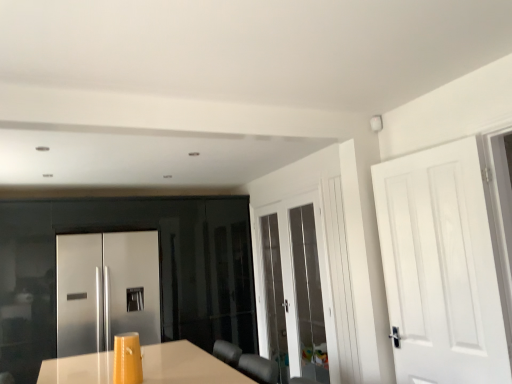
You are a GUI agent. You are given a task and a screenshot of the screen. Output one action in this format:
    pyautogui.click(x=<x>, y=<y>)
    Task: Click on the white matte door at right, arranged as the 3th door when viewed from the left
    
    Given the screenshot: What is the action you would take?
    pyautogui.click(x=442, y=266)

Locate an element on the screen. white glossy door at center, the second door from the front is located at coordinates (293, 288).

Is satin stainless steel refrigerator at center, placed as the first door when sorted from back to front, inside or outside of white matte door at right, which is the third door from back to front?

satin stainless steel refrigerator at center, placed as the first door when sorted from back to front, is not inside white matte door at right, which is the third door from back to front, it's outside.

Is satin stainless steel refrigerator at center, which is the third door in front-to-back order, bigger than white matte door at right, acting as the 1th door starting from the front?

Yes, satin stainless steel refrigerator at center, which is the third door in front-to-back order, is bigger than white matte door at right, acting as the 1th door starting from the front.

Based on the photo, which object is further away from the camera, satin stainless steel refrigerator at center, which ranks as the 1th door in left-to-right order, or white matte door at right, which is the third door from back to front?

satin stainless steel refrigerator at center, which ranks as the 1th door in left-to-right order.

From the image's perspective, which one is positioned lower, satin stainless steel refrigerator at center, marked as the 3th door in a right-to-left arrangement, or white matte door at right, arranged as the 3th door when viewed from the left?

satin stainless steel refrigerator at center, marked as the 3th door in a right-to-left arrangement, is shown below in the image.

Does white glossy door at center, the second door from the front, have a larger size compared to white matte door at right, acting as the 1th door starting from the front?

Yes.

From the image's perspective, is white glossy door at center, the second door from the front, positioned above or below white matte door at right, arranged as the 3th door when viewed from the left?

Based on their image positions, white glossy door at center, the second door from the front, is located beneath white matte door at right, arranged as the 3th door when viewed from the left.

Is white glossy door at center, the second door from the front, looking in the opposite direction of white matte door at right, which is counted as the first door, starting from the right?

No, white glossy door at center, the second door from the front,'s orientation is not away from white matte door at right, which is counted as the first door, starting from the right.

Identify the location of the 1st door below when counting from the white matte door at right, which is the third door from back to front (from the image's perspective). (293, 288).

Which object is positioned more to the right, white glossy door at center, which is counted as the second door, starting from the back, or satin stainless steel refrigerator at center, which is the third door in front-to-back order?

From the viewer's perspective, white glossy door at center, which is counted as the second door, starting from the back, appears more on the right side.

From the image's perspective, between white glossy door at center, the second door from the front, and satin stainless steel refrigerator at center, placed as the first door when sorted from back to front, which one is located above?

white glossy door at center, the second door from the front.

Is white glossy door at center, the second door from the front, directly adjacent to satin stainless steel refrigerator at center, which ranks as the 1th door in left-to-right order?

They are not placed beside each other.

Can you confirm if white glossy door at center, which is counted as the second door, starting from the back, is thinner than satin stainless steel refrigerator at center, marked as the 3th door in a right-to-left arrangement?

Indeed, white glossy door at center, which is counted as the second door, starting from the back, has a lesser width compared to satin stainless steel refrigerator at center, marked as the 3th door in a right-to-left arrangement.

Between white matte door at right, which is the third door from back to front, and white glossy door at center, the 2th door when ordered from right to left, which one has less height?

Standing shorter between the two is white matte door at right, which is the third door from back to front.

Is white matte door at right, acting as the 1th door starting from the front, facing away from white glossy door at center, which is counted as the second door, starting from the back?

No.

The width and height of the screenshot is (512, 384). Identify the location of the 1st door to the left of the white matte door at right, arranged as the 3th door when viewed from the left, counting from the anchor's position. (293, 288).

From a real-world perspective, is white matte door at right, acting as the 1th door starting from the front, located higher than white glossy door at center, the second door positioned from the left?

Yes.

Which object is positioned more to the right, satin stainless steel refrigerator at center, placed as the first door when sorted from back to front, or white glossy door at center, which is counted as the second door, starting from the back?

From the viewer's perspective, white glossy door at center, which is counted as the second door, starting from the back, appears more on the right side.

Considering the sizes of satin stainless steel refrigerator at center, marked as the 3th door in a right-to-left arrangement, and white glossy door at center, the 2th door when ordered from right to left, in the image, is satin stainless steel refrigerator at center, marked as the 3th door in a right-to-left arrangement, bigger or smaller than white glossy door at center, the 2th door when ordered from right to left,?

Considering their sizes, satin stainless steel refrigerator at center, marked as the 3th door in a right-to-left arrangement, takes up more space than white glossy door at center, the 2th door when ordered from right to left.

Is satin stainless steel refrigerator at center, placed as the first door when sorted from back to front, far away from white glossy door at center, the second door from the front?

Yes.

Could you tell me if satin stainless steel refrigerator at center, placed as the first door when sorted from back to front, is facing white glossy door at center, the second door from the front?

No, satin stainless steel refrigerator at center, placed as the first door when sorted from back to front, is not turned towards white glossy door at center, the second door from the front.

Would you say white matte door at right, which is counted as the first door, starting from the right, contains satin stainless steel refrigerator at center, placed as the first door when sorted from back to front?

No, satin stainless steel refrigerator at center, placed as the first door when sorted from back to front, is not a part of white matte door at right, which is counted as the first door, starting from the right.

Are white matte door at right, which is the third door from back to front, and satin stainless steel refrigerator at center, placed as the first door when sorted from back to front, making contact?

white matte door at right, which is the third door from back to front, and satin stainless steel refrigerator at center, placed as the first door when sorted from back to front, are clearly separated.

How far apart are white matte door at right, acting as the 1th door starting from the front, and satin stainless steel refrigerator at center, which is the third door in front-to-back order?

A distance of 2.75 meters exists between white matte door at right, acting as the 1th door starting from the front, and satin stainless steel refrigerator at center, which is the third door in front-to-back order.

Where is `door that is the 2nd object located below the white matte door at right, which is the third door from back to front (from the image's perspective)`? door that is the 2nd object located below the white matte door at right, which is the third door from back to front (from the image's perspective) is located at coordinates point(106,290).

In order to click on the 2nd door behind the white matte door at right, arranged as the 3th door when viewed from the left, starting your count from the anchor in this screenshot , I will do `click(106, 290)`.

The width and height of the screenshot is (512, 384). Identify the location of door that is the 1st object directly below the white matte door at right, arranged as the 3th door when viewed from the left (from a real-world perspective). (293, 288).

Based on the photo, estimate the real-world distances between objects in this image. Which object is further from white glossy door at center, which is counted as the second door, starting from the back, satin stainless steel refrigerator at center, which is the third door in front-to-back order, or white matte door at right, arranged as the 3th door when viewed from the left?

Among the two, white matte door at right, arranged as the 3th door when viewed from the left, is located further to white glossy door at center, which is counted as the second door, starting from the back.

Considering their positions, is satin stainless steel refrigerator at center, marked as the 3th door in a right-to-left arrangement, positioned further to white matte door at right, which is the third door from back to front, than white glossy door at center, which is counted as the second door, starting from the back?

satin stainless steel refrigerator at center, marked as the 3th door in a right-to-left arrangement, lies further to white matte door at right, which is the third door from back to front, than the other object.

Looking at the image, which one is located closer to satin stainless steel refrigerator at center, which is the third door in front-to-back order, white glossy door at center, which is counted as the second door, starting from the back, or white matte door at right, which is counted as the first door, starting from the right?

white glossy door at center, which is counted as the second door, starting from the back, is closer to satin stainless steel refrigerator at center, which is the third door in front-to-back order.

When comparing their distances from white matte door at right, acting as the 1th door starting from the front, does white glossy door at center, the second door from the front, or satin stainless steel refrigerator at center, placed as the first door when sorted from back to front, seem closer?

Based on the image, white glossy door at center, the second door from the front, appears to be nearer to white matte door at right, acting as the 1th door starting from the front.

From the image, which object appears to be farther from satin stainless steel refrigerator at center, placed as the first door when sorted from back to front, white matte door at right, arranged as the 3th door when viewed from the left, or white glossy door at center, the second door positioned from the left?

white matte door at right, arranged as the 3th door when viewed from the left.

Estimate the real-world distances between objects in this image. Which object is further from white glossy door at center, the second door positioned from the left, white matte door at right, acting as the 1th door starting from the front, or satin stainless steel refrigerator at center, marked as the 3th door in a right-to-left arrangement?

white matte door at right, acting as the 1th door starting from the front, is positioned further to the anchor white glossy door at center, the second door positioned from the left.

Where is `door between satin stainless steel refrigerator at center, which ranks as the 1th door in left-to-right order, and white matte door at right, which is counted as the first door, starting from the right, from left to right`? The image size is (512, 384). door between satin stainless steel refrigerator at center, which ranks as the 1th door in left-to-right order, and white matte door at right, which is counted as the first door, starting from the right, from left to right is located at coordinates (293, 288).